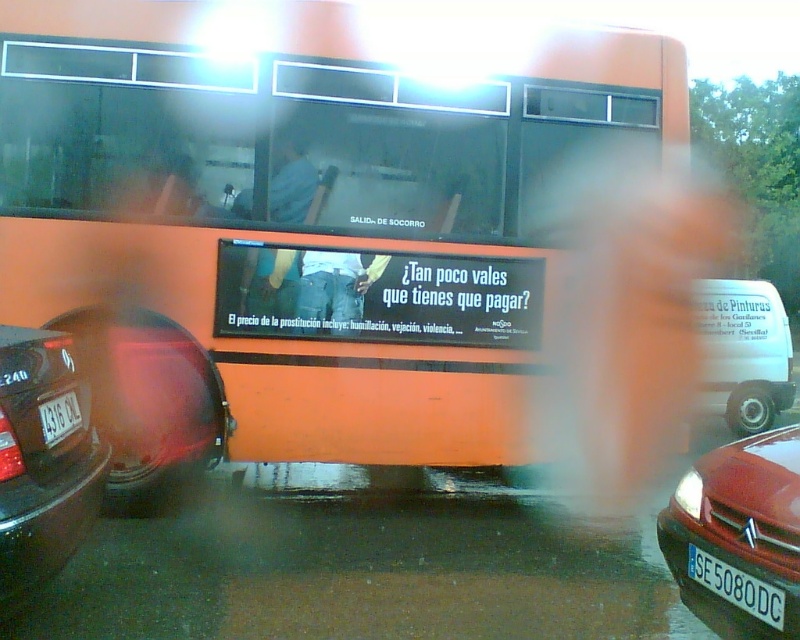
Question: In this image, where is shiny red car at lower right located relative to shiny black car at left?

Choices:
 (A) right
 (B) left

Answer: (A)

Question: Among these points, which one is nearest to the camera?

Choices:
 (A) tap(732, 564)
 (B) tap(46, 406)
 (C) tap(218, 380)

Answer: (A)

Question: Which point is closer to the camera?

Choices:
 (A) (737, 460)
 (B) (768, 330)

Answer: (A)

Question: Is white matte van at right further to camera compared to white plastic license plate at lower right?

Choices:
 (A) no
 (B) yes

Answer: (B)

Question: Is white matte van at right bigger than white plastic license plate at lower right?

Choices:
 (A) no
 (B) yes

Answer: (B)

Question: Which point is farther to the camera?

Choices:
 (A) shiny black car at left
 (B) shiny red car at lower right
 (C) white plastic license plate at lower left

Answer: (C)